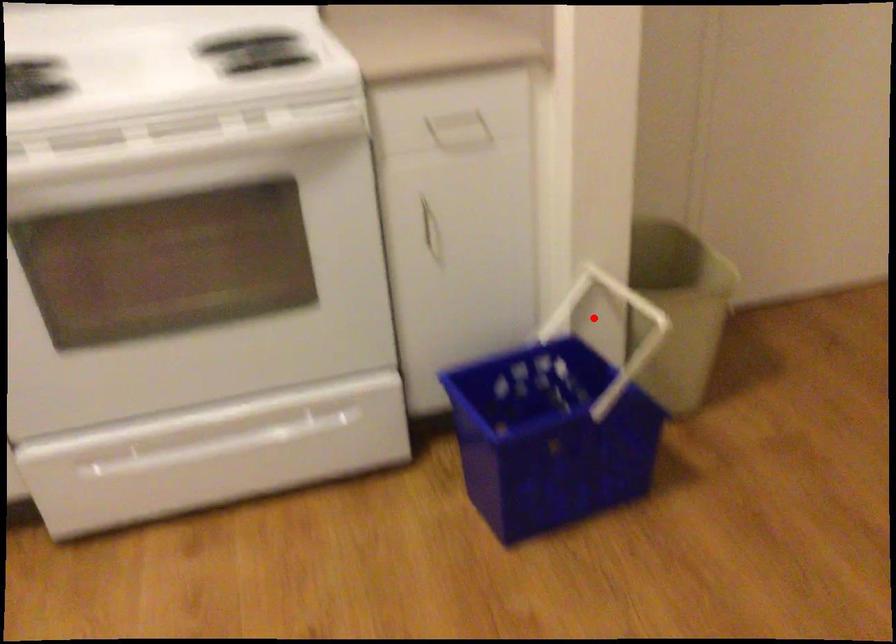
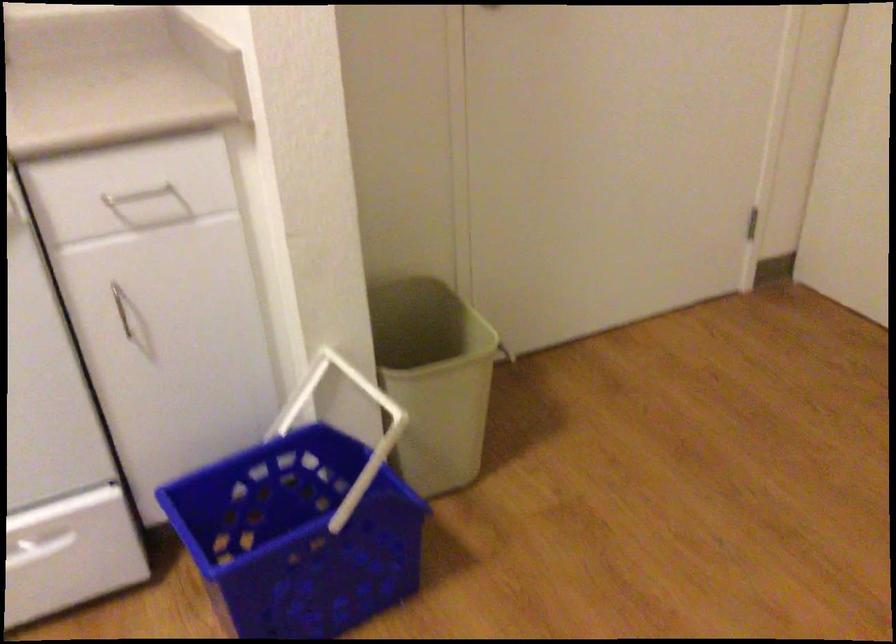
Locate, in the second image, the point that corresponds to the highlighted location in the first image.

(343, 402)